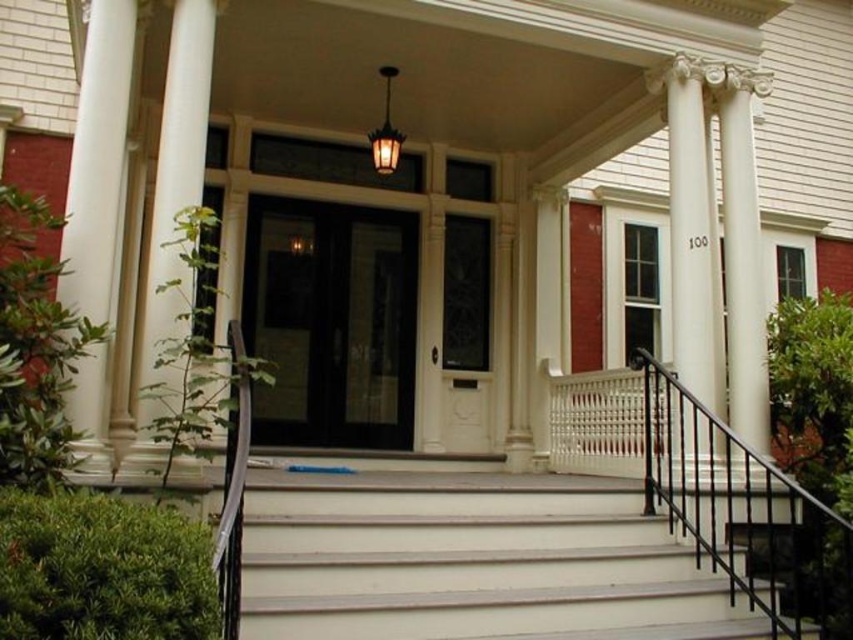
Which of these two, white painted wood stairs at center or white smooth column at center, stands taller?

white smooth column at center is taller.

Is point (370, 609) farther from camera compared to point (712, 275)?

No, it is not.

Locate an element on the screen. This screenshot has height=640, width=853. white painted wood stairs at center is located at coordinates (473, 561).

Find the location of a particular element. This screenshot has width=853, height=640. white smooth column at center is located at coordinates (692, 228).

Based on the photo, which is below, white smooth column at center or white smooth column at right?

white smooth column at right is below.

Locate an element on the screen. The image size is (853, 640). white smooth column at center is located at coordinates (692, 228).

Identify the location of white smooth column at center. The height and width of the screenshot is (640, 853). (692, 228).

Who is lower down, white smooth column at left or white smooth column at center?

white smooth column at center

Is point (85, 216) positioned in front of point (692, 464)?

Yes, it is in front of point (692, 464).

This screenshot has width=853, height=640. Find the location of `white smooth column at left`. white smooth column at left is located at coordinates (97, 160).